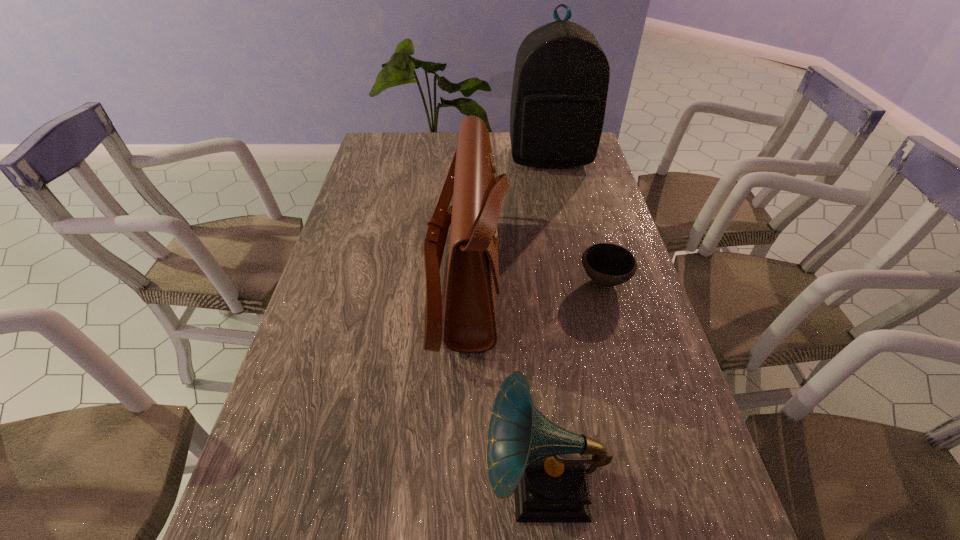
The height and width of the screenshot is (540, 960). What are the coordinates of `object that is at the far right corner` in the screenshot? It's located at click(561, 78).

The image size is (960, 540). Identify the location of blank area at the left edge. (347, 303).

You are a GUI agent. You are given a task and a screenshot of the screen. Output one action in this format:
    pyautogui.click(x=<x>, y=<y>)
    Task: Click on the free space at the right edge of the desktop
    The image size is (960, 540).
    Given the screenshot: What is the action you would take?
    pyautogui.click(x=571, y=185)

I want to click on free space between the second tallest object and the farthest object, so click(508, 217).

The width and height of the screenshot is (960, 540). I want to click on free space between the satchel and the bowl, so 535,279.

Identify which object is the nearest to the second shortest object. Please provide its 2D coordinates. Your answer should be formatted as a tuple, i.e. [(x, y)], where the tuple contains the x and y coordinates of a point satisfying the conditions above.

[(470, 326)]

Locate an element on the screen. The height and width of the screenshot is (540, 960). object that stands as the second closest to the tallest object is located at coordinates (608, 265).

The width and height of the screenshot is (960, 540). Identify the location of vacant space that satisfies the following two spatial constraints: 1. on the front flap of the shortest object; 2. on the left side of the satchel. (467, 281).

Identify the location of blank space that satisfies the following two spatial constraints: 1. on the front-facing side of the bowl; 2. on the left side of the tallest object. The image size is (960, 540). (577, 281).

Where is `vacant space that satisfies the following two spatial constraints: 1. on the front-facing side of the farthest object; 2. on the front flap of the satchel`? This screenshot has height=540, width=960. vacant space that satisfies the following two spatial constraints: 1. on the front-facing side of the farthest object; 2. on the front flap of the satchel is located at coordinates (576, 276).